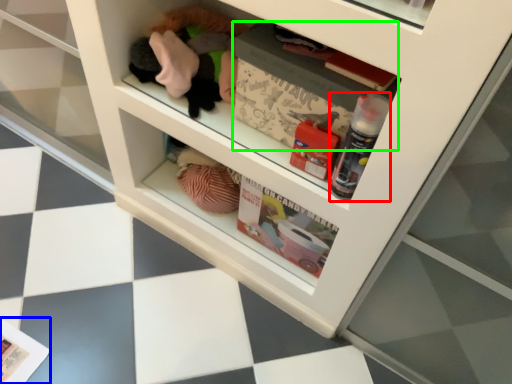
Question: Which is farther away from bottle (highlighted by a red box)? magazine (highlighted by a blue box) or magazine (highlighted by a green box)?

Choices:
 (A) magazine
 (B) magazine

Answer: (A)